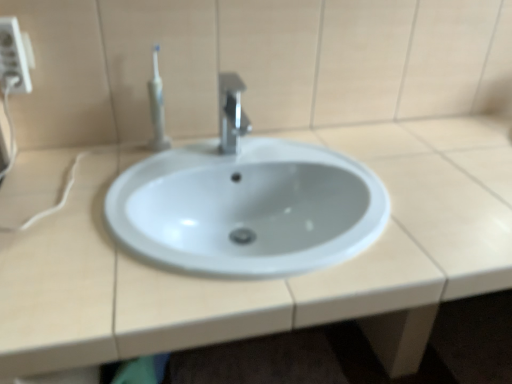
The image size is (512, 384). I want to click on free space behind polished metallic faucet at center, so click(254, 147).